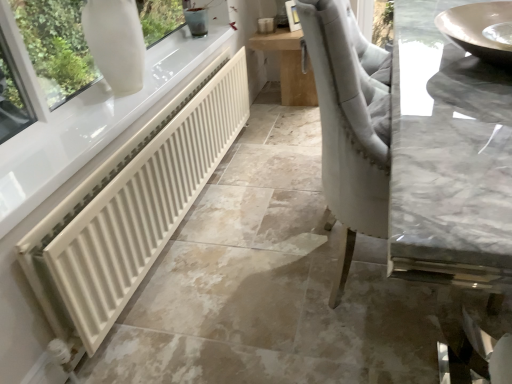
Question: Does white matte radiator at lower left come behind wooden table at center?

Choices:
 (A) no
 (B) yes

Answer: (A)

Question: Considering the relative sizes of white matte radiator at lower left and wooden table at center in the image provided, is white matte radiator at lower left thinner than wooden table at center?

Choices:
 (A) no
 (B) yes

Answer: (B)

Question: Would you say white matte radiator at lower left is outside wooden table at center?

Choices:
 (A) yes
 (B) no

Answer: (A)

Question: Is white matte radiator at lower left wider than wooden table at center?

Choices:
 (A) yes
 (B) no

Answer: (B)

Question: Is white matte radiator at lower left placed right next to wooden table at center?

Choices:
 (A) yes
 (B) no

Answer: (B)

Question: Does white matte radiator at lower left have a larger size compared to wooden table at center?

Choices:
 (A) no
 (B) yes

Answer: (A)

Question: Does wooden table at center have a lesser width compared to white matte radiator at lower left?

Choices:
 (A) no
 (B) yes

Answer: (A)

Question: Is white matte radiator at lower left located within wooden table at center?

Choices:
 (A) no
 (B) yes

Answer: (A)

Question: Would you say wooden table at center is a long distance from white matte radiator at lower left?

Choices:
 (A) no
 (B) yes

Answer: (B)

Question: Is wooden table at center directly adjacent to white matte radiator at lower left?

Choices:
 (A) no
 (B) yes

Answer: (A)

Question: From the image's perspective, is wooden table at center located beneath white matte radiator at lower left?

Choices:
 (A) yes
 (B) no

Answer: (B)

Question: Is wooden table at center positioned with its back to white matte radiator at lower left?

Choices:
 (A) yes
 (B) no

Answer: (B)

Question: From the image's perspective, would you say wooden table at center is shown under matte gray sink at upper right?

Choices:
 (A) yes
 (B) no

Answer: (B)